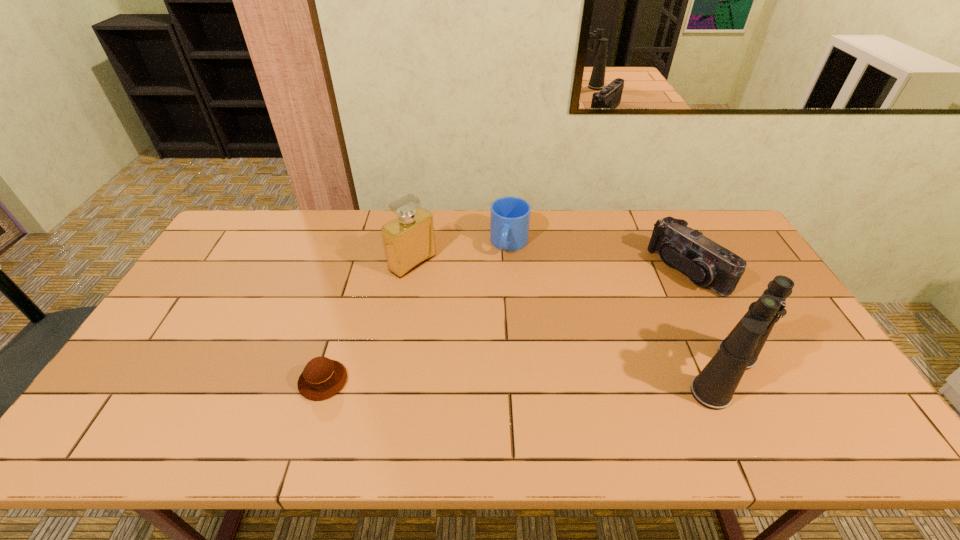
The height and width of the screenshot is (540, 960). I want to click on mug that is positioned at the far edge, so (509, 216).

Find the location of a particular element. muffin that is at the near edge is located at coordinates (322, 378).

This screenshot has height=540, width=960. I want to click on binoculars at the near edge, so click(x=713, y=388).

Locate an element on the screen. This screenshot has height=540, width=960. object located in the right edge section of the desktop is located at coordinates (706, 263).

At what (x,y) coordinates should I click in order to perform the action: click on object at the far right corner. Please return your answer as a coordinate pair (x, y). Looking at the image, I should click on (706, 263).

Locate an element on the screen. The width and height of the screenshot is (960, 540). free region at the far edge of the desktop is located at coordinates (300, 213).

Locate an element on the screen. free region at the near edge of the desktop is located at coordinates (573, 382).

You are a GUI agent. You are given a task and a screenshot of the screen. Output one action in this format:
    pyautogui.click(x=<x>, y=<y>)
    Task: Click on the free space at the left edge
    
    Given the screenshot: What is the action you would take?
    pyautogui.click(x=222, y=312)

I want to click on vacant area at the right edge, so 800,344.

You are a GUI agent. You are given a task and a screenshot of the screen. Output one action in this format:
    pyautogui.click(x=<x>, y=<y>)
    Task: Click on the free space at the far left corner of the desktop
    
    Given the screenshot: What is the action you would take?
    pyautogui.click(x=247, y=222)